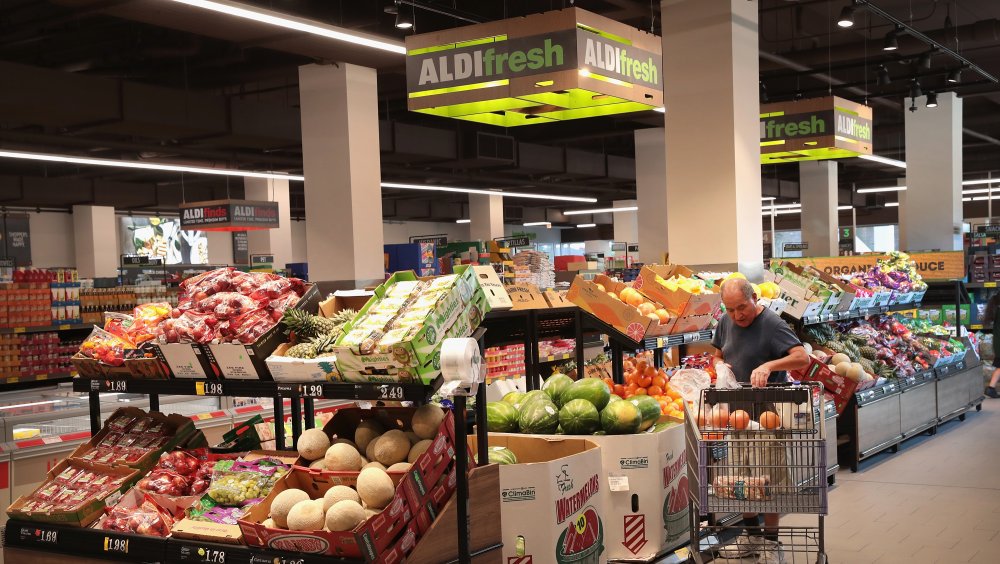
This screenshot has width=1000, height=564. Identify the location of floor. (991, 449).